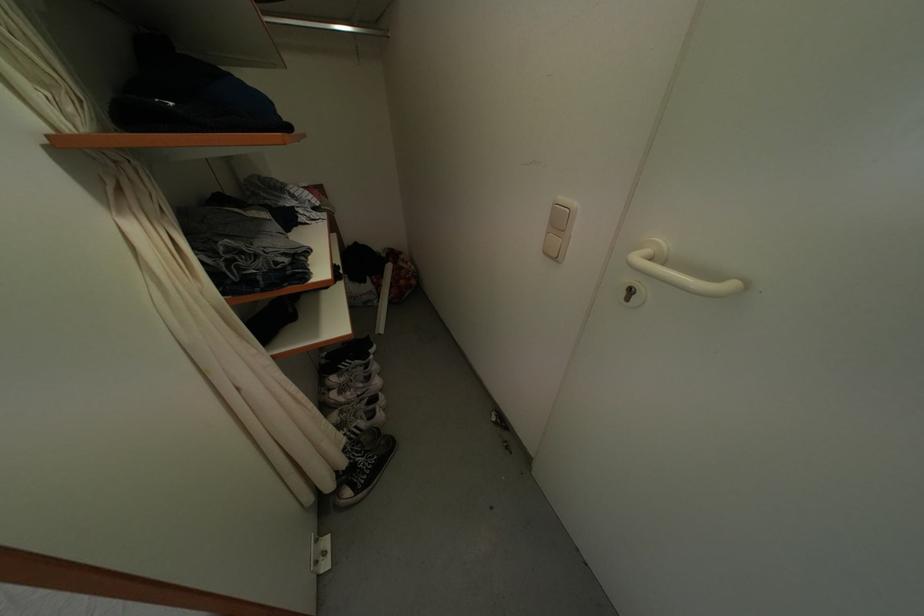
Where would you grasp the metal closet rod? Please return your answer as a coordinate pair (x, y).

(324, 26)